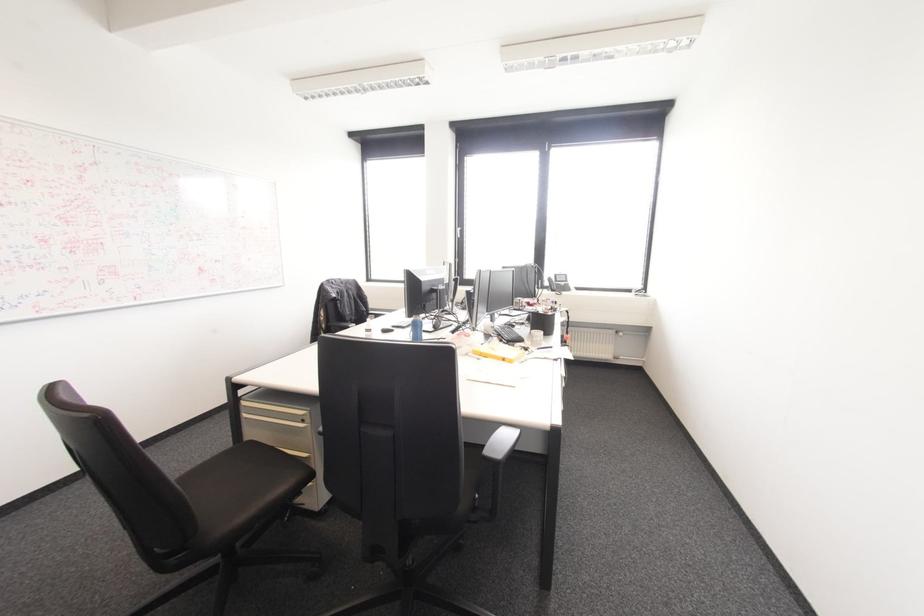
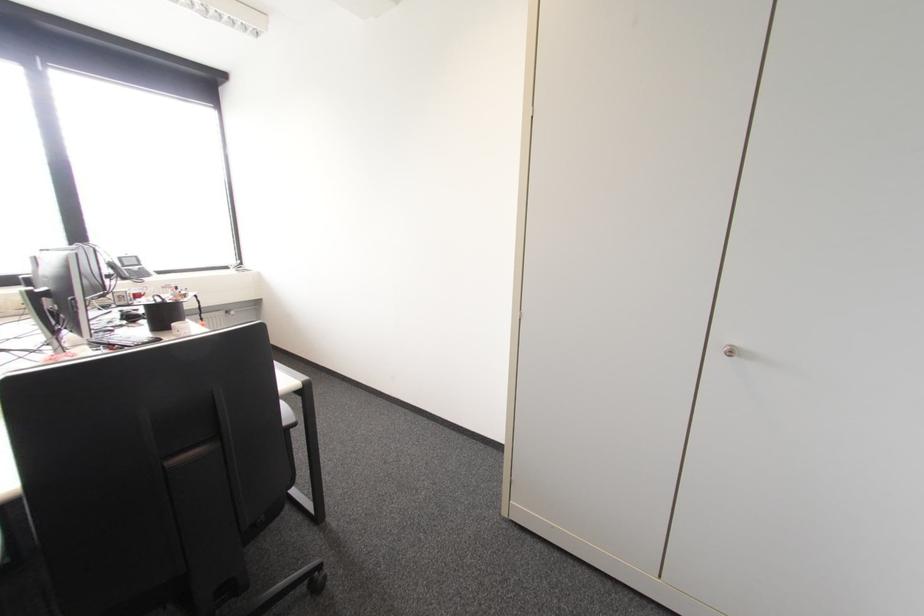
Question: The camera is either moving clockwise (left) or counter-clockwise (right) around the object. The first image is from the beginning of the video and the second image is from the end. Is the camera moving left or right when shooting the video?

Choices:
 (A) Left
 (B) Right

Answer: (A)